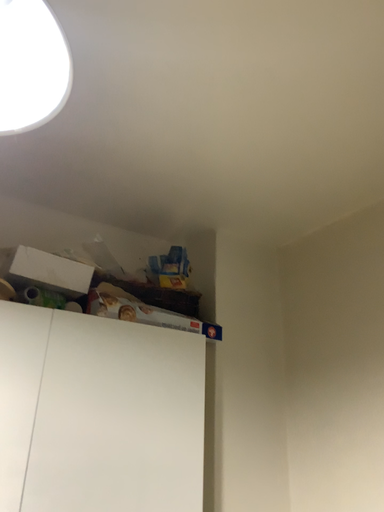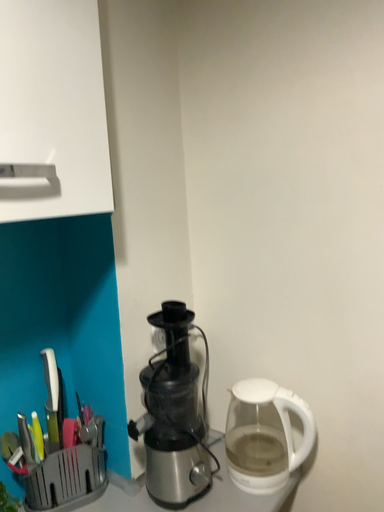
Question: How did the camera likely rotate when shooting the video?

Choices:
 (A) rotated left
 (B) rotated right

Answer: (B)